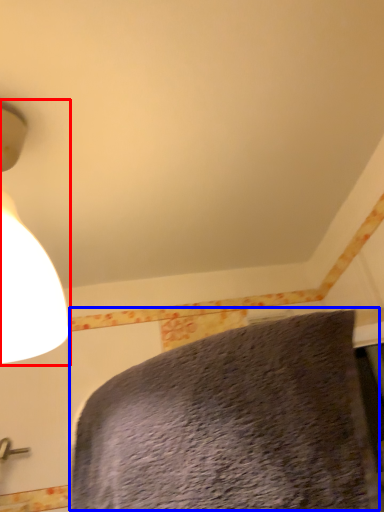
Question: Which of the following is the farthest to the observer, lamp (highlighted by a red box) or bed (highlighted by a blue box)?

Choices:
 (A) lamp
 (B) bed

Answer: (A)